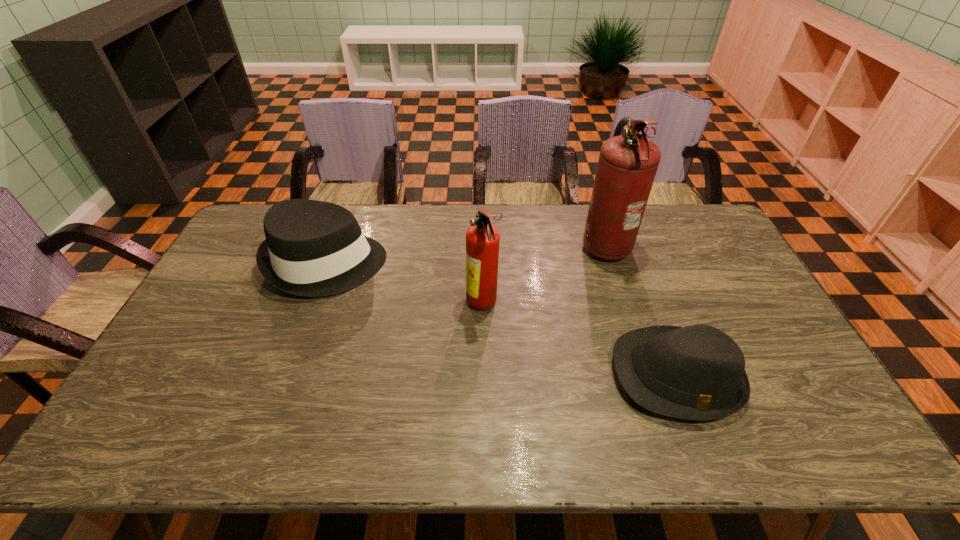
Locate an element on the screen. The image size is (960, 540). free spot between the taller fedora and the taller fire extinguisher is located at coordinates (466, 254).

Where is `free spot between the left fire extinguisher and the shortest object`? The height and width of the screenshot is (540, 960). free spot between the left fire extinguisher and the shortest object is located at coordinates (580, 340).

Locate an element on the screen. free space between the shorter fedora and the nearer fire extinguisher is located at coordinates (580, 340).

The height and width of the screenshot is (540, 960). What are the coordinates of `free space between the right fedora and the leftmost object` in the screenshot? It's located at (501, 320).

Identify the location of vacant space in between the farther fedora and the right fedora. This screenshot has width=960, height=540. (501, 320).

Locate an element on the screen. This screenshot has width=960, height=540. free space between the nearer fire extinguisher and the farther fedora is located at coordinates (404, 284).

Identify the location of object that is the closest to the farther fedora. (482, 239).

The image size is (960, 540). Identify the location of object that is the closest to the leftmost object. (482, 239).